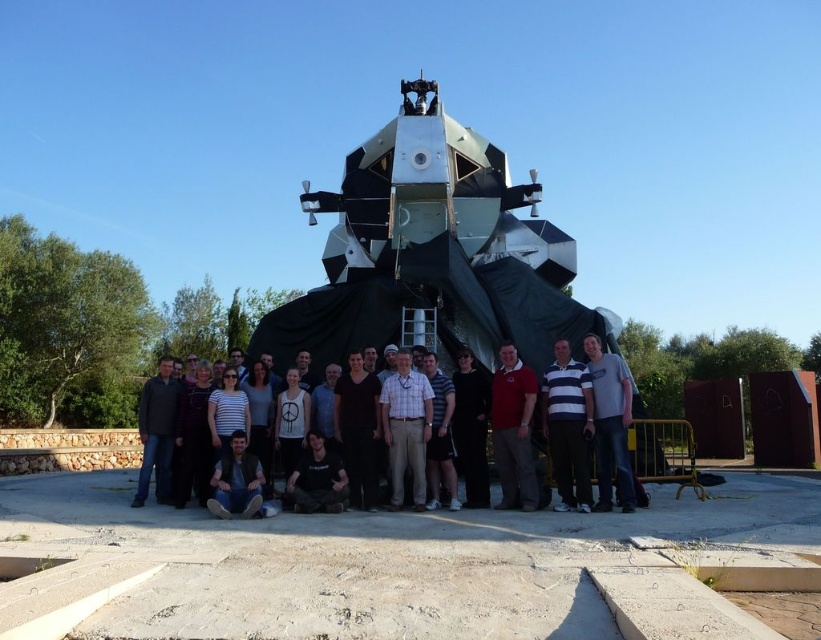
Which is more to the left, matte black shirt at center or dark brown leather jacket at lower center?

dark brown leather jacket at lower center is more to the left.

Which of these two, matte black shirt at center or dark brown leather jacket at lower center, stands shorter?

With less height is dark brown leather jacket at lower center.

Is point (627, 420) positioned in front of point (236, 506)?

No, (627, 420) is behind (236, 506).

At what (x,y) coordinates should I click in order to perform the action: click on matte black shirt at center. Please return your answer as a coordinate pair (x, y). This screenshot has height=640, width=821. Looking at the image, I should click on (592, 429).

Does matte black shirt at center have a lesser height compared to matte red shirt at center?

No, matte black shirt at center is not shorter than matte red shirt at center.

Can you confirm if matte black shirt at center is positioned to the left of matte red shirt at center?

Indeed, matte black shirt at center is positioned on the left side of matte red shirt at center.

Describe the element at coordinates (592, 429) in the screenshot. I see `matte black shirt at center` at that location.

Where is `matte black shirt at center`? This screenshot has width=821, height=640. matte black shirt at center is located at coordinates (592, 429).

Does black matte dress at center have a smaller size compared to dark brown leather jacket at lower center?

No, black matte dress at center is not smaller than dark brown leather jacket at lower center.

Can you confirm if black matte dress at center is wider than dark brown leather jacket at lower center?

Yes, black matte dress at center is wider than dark brown leather jacket at lower center.

Is point (468, 408) positioned before point (260, 484)?

No, it is not.

Locate an element on the screen. Image resolution: width=821 pixels, height=640 pixels. black matte dress at center is located at coordinates coord(471,428).